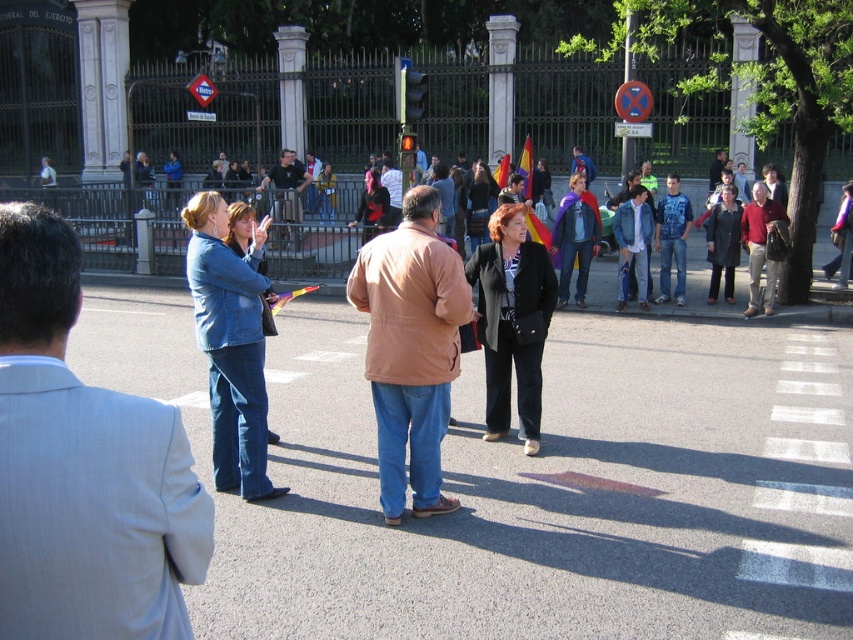
Between brown leather jacket at center and dark blue jeans at center, which one has more height?

Standing taller between the two is brown leather jacket at center.

Who is higher up, brown leather jacket at center or dark blue jeans at center?

dark blue jeans at center is above.

Is point (383, 342) closer to camera compared to point (291, 220)?

Yes.

Identify the location of brown leather jacket at center. The width and height of the screenshot is (853, 640). (410, 349).

What do you see at coordinates (83, 468) in the screenshot?
I see `light blue denim jeans at center` at bounding box center [83, 468].

Measure the distance between point (103, 552) and camera.

A distance of 1.86 meters exists between point (103, 552) and camera.

Identify the location of light blue denim jeans at center. This screenshot has width=853, height=640. 83,468.

How distant is light blue denim jeans at center from dark blue jeans at center?

A distance of 17.10 meters exists between light blue denim jeans at center and dark blue jeans at center.

Find the location of `light blue denim jeans at center`. light blue denim jeans at center is located at coordinates (83, 468).

Is point (107, 534) farther from camera compared to point (276, 173)?

No, (107, 534) is closer to viewer.

I want to click on light blue denim jeans at center, so click(x=83, y=468).